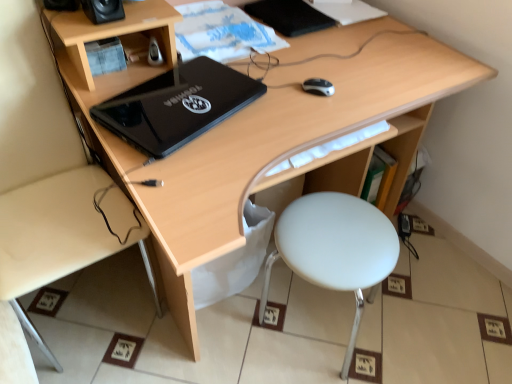
You are a GUI agent. You are given a task and a screenshot of the screen. Output one action in this format:
    pyautogui.click(x=<x>, y=<y>)
    Task: Click on the vacant region above black glossy laptop at center (from a real-world perspective)
    The width and height of the screenshot is (512, 384).
    Given the screenshot: What is the action you would take?
    pyautogui.click(x=200, y=110)